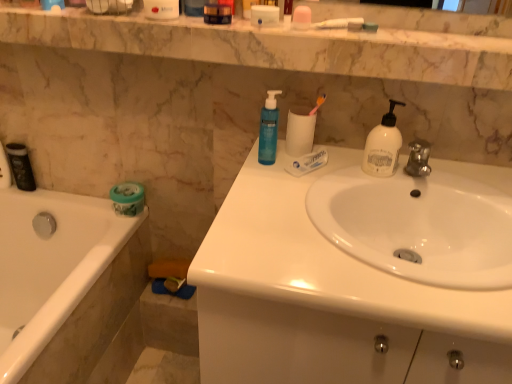
Locate an element on the screen. Image resolution: width=512 pixels, height=384 pixels. vacant area to the left of green matte jar at lower left, arranged as the second toilet paper when viewed from the front is located at coordinates (87, 206).